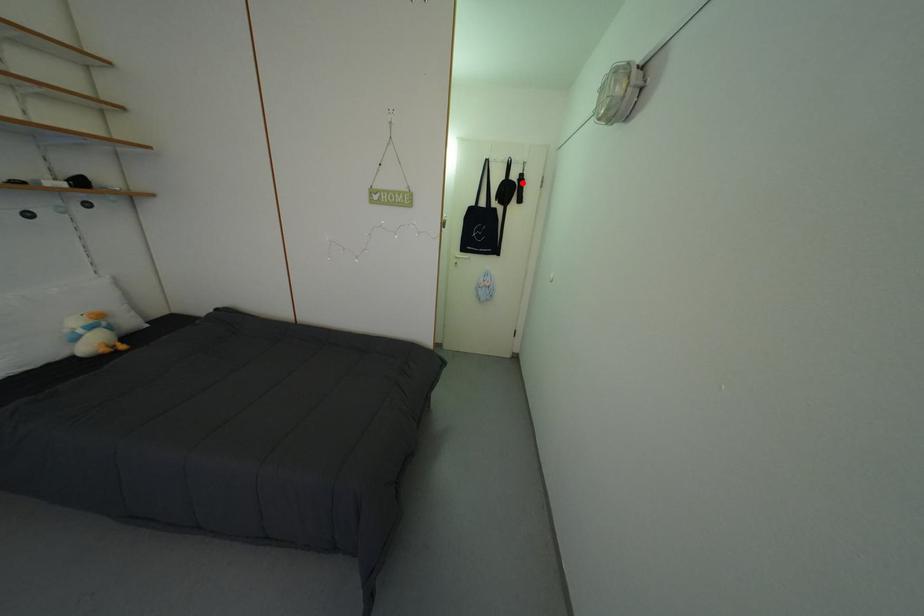
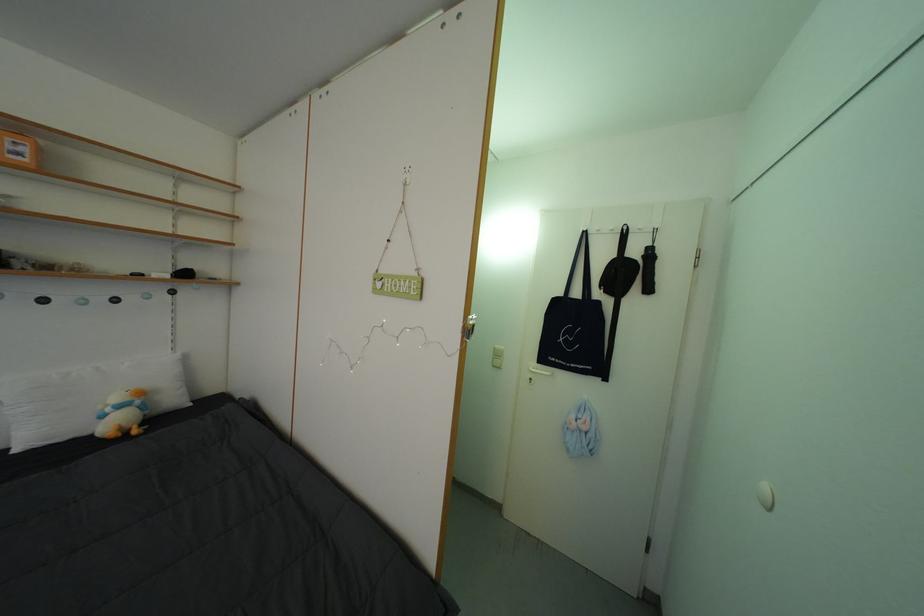
Where in the second image is the point corresponding to the highlighted location from the first image?

(642, 257)